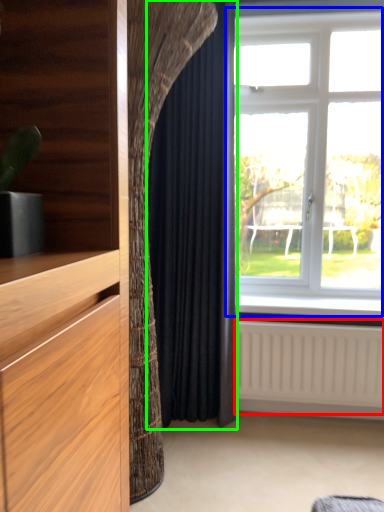
Question: Considering the real-world distances, which object is farthest from radiator (highlighted by a red box)? window (highlighted by a blue box) or curtain (highlighted by a green box)?

Choices:
 (A) window
 (B) curtain

Answer: (A)